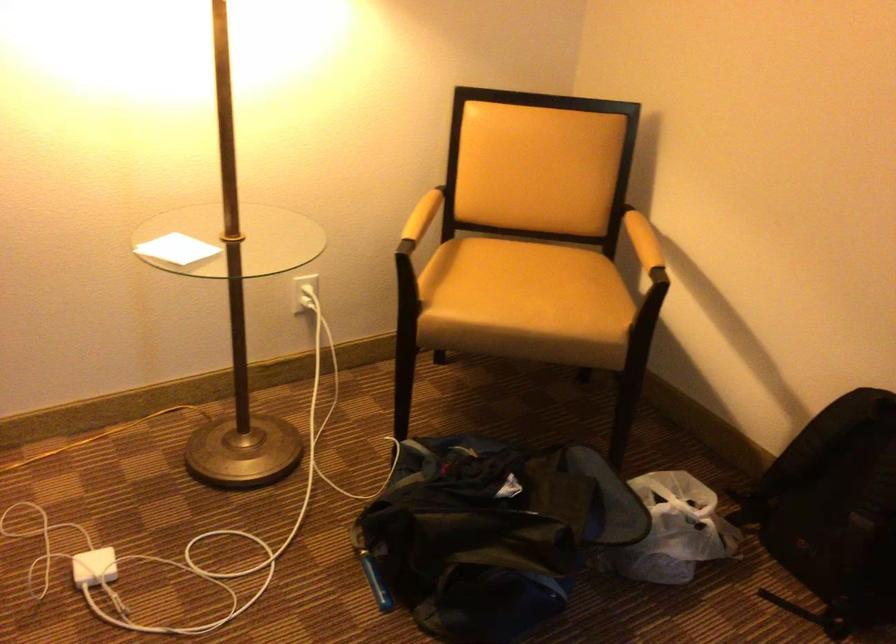
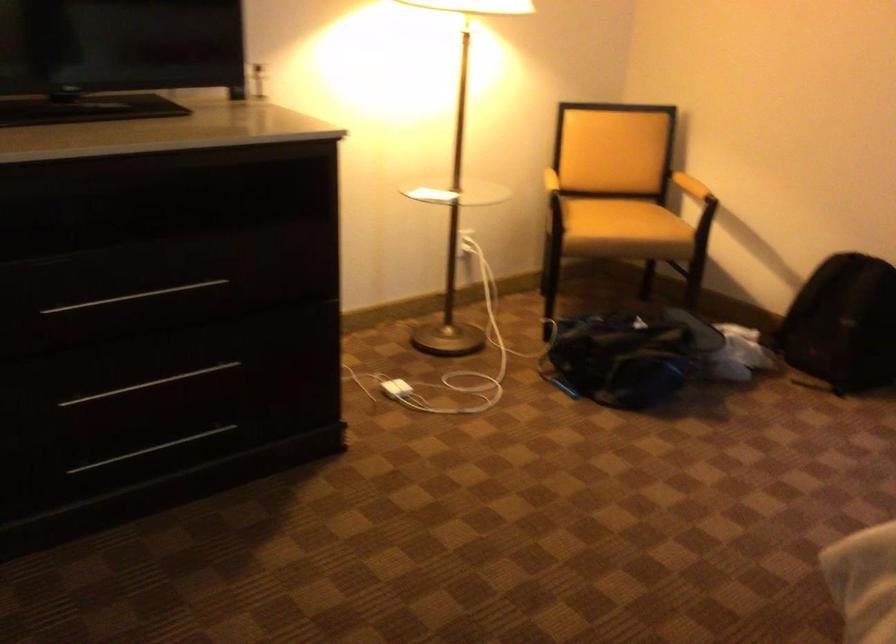
Find the pixel in the second image that matches point (528, 303) in the first image.

(623, 220)